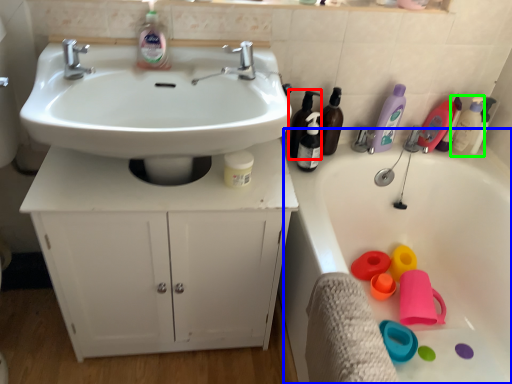
Question: Which object is the closest to the toiletry (highlighted by a red box)? Choose among these: bath (highlighted by a blue box) or cleaning product (highlighted by a green box).

Choices:
 (A) bath
 (B) cleaning product

Answer: (A)